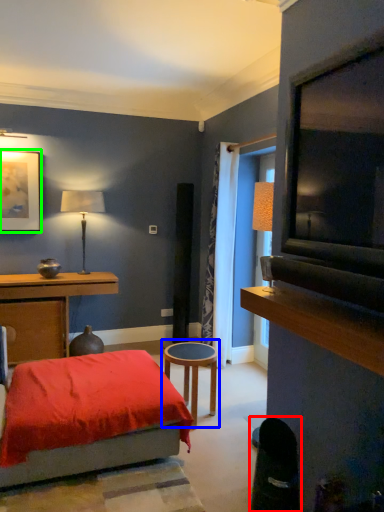
Question: Based on their relative distances, which object is farther from swivel chair (highlighted by a red box)? Choose from table (highlighted by a blue box) and picture frame (highlighted by a green box).

Choices:
 (A) table
 (B) picture frame

Answer: (B)